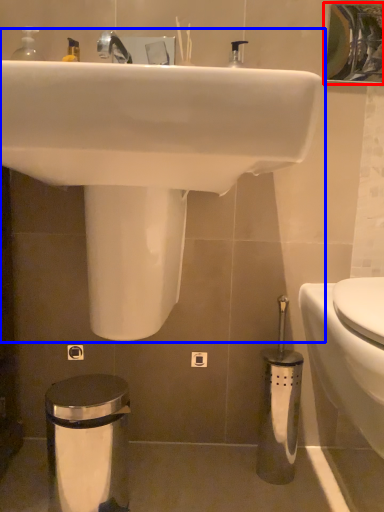
Question: Which object is further to the camera taking this photo, mirror (highlighted by a red box) or sink (highlighted by a blue box)?

Choices:
 (A) mirror
 (B) sink

Answer: (A)